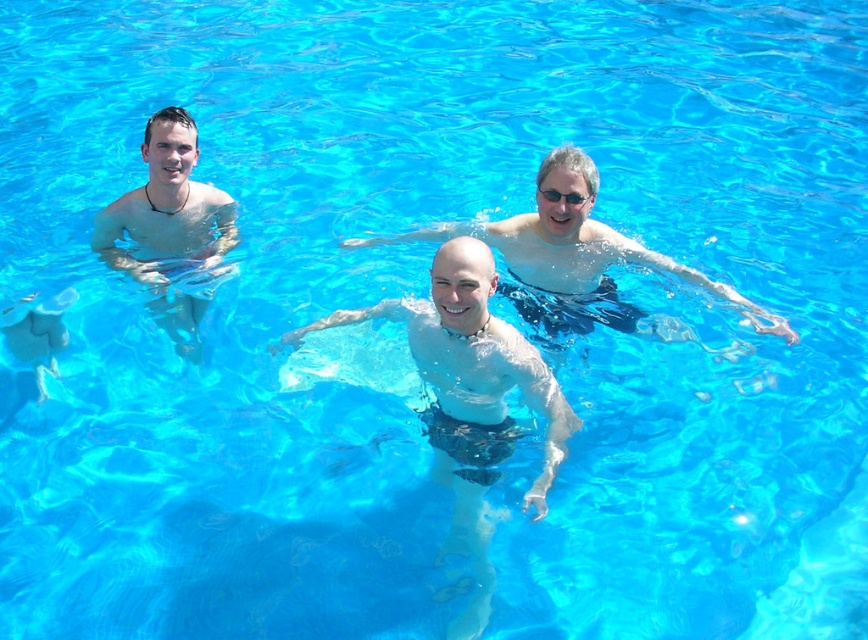
Question: Among these objects, which one is nearest to the camera?

Choices:
 (A) matte black swim trunks at left
 (B) transparent plastic goggles at center

Answer: (B)

Question: Can you confirm if bare skin at center is positioned to the left of matte black swim trunks at center?

Choices:
 (A) yes
 (B) no

Answer: (A)

Question: Can you confirm if matte black swim trunks at left is positioned above transparent plastic goggles at center?

Choices:
 (A) no
 (B) yes

Answer: (A)

Question: Estimate the real-world distances between objects in this image. Which object is farther from the bare skin at center?

Choices:
 (A) transparent plastic goggles at center
 (B) matte black swim trunks at center

Answer: (A)

Question: Estimate the real-world distances between objects in this image. Which object is farther from the transparent plastic goggles at center?

Choices:
 (A) bare skin at center
 (B) matte black swim trunks at left
 (C) matte black swim trunks at center

Answer: (B)

Question: Is bare skin at center closer to the viewer compared to transparent plastic goggles at center?

Choices:
 (A) no
 (B) yes

Answer: (B)